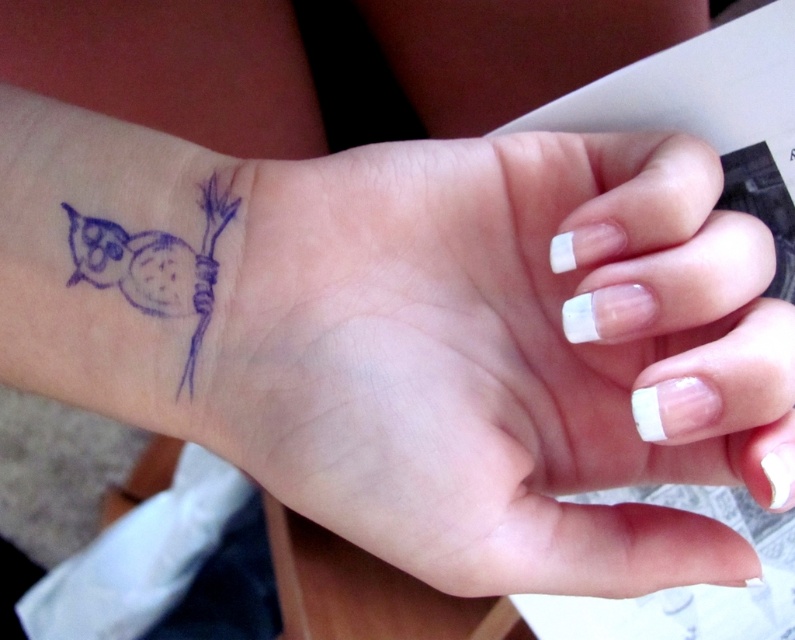
Is point (481, 404) farther from camera compared to point (212, 216)?

Yes, point (481, 404) is farther from viewer.

Where is `matte blue tattoo at upper left`? matte blue tattoo at upper left is located at coordinates (507, 358).

Which is behind, point (491, 593) or point (123, 282)?

Positioned behind is point (123, 282).

Locate an element on the screen. The image size is (795, 640). matte blue tattoo at upper left is located at coordinates (507, 358).